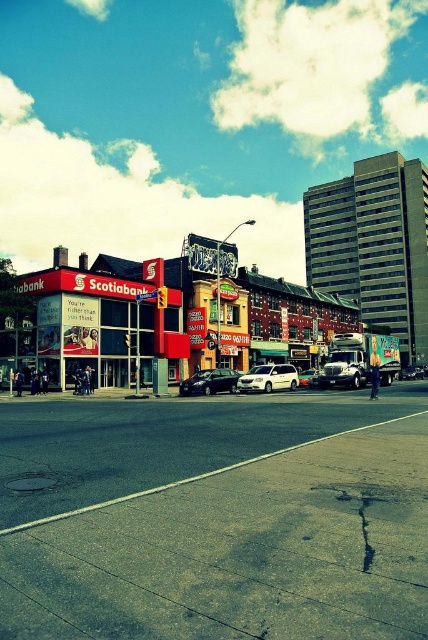
Question: Is matte red bank at center closer to the viewer compared to silver metallic sedan at center?

Choices:
 (A) no
 (B) yes

Answer: (B)

Question: Which point is farther from the camera taking this photo?

Choices:
 (A) (332, 365)
 (B) (306, 545)
 (C) (190, 378)

Answer: (A)

Question: Which point appears closest to the camera in this image?

Choices:
 (A) click(x=312, y=380)
 (B) click(x=219, y=371)
 (C) click(x=45, y=323)

Answer: (B)

Question: Does matte red bank at center appear over metallic silver truck at center?

Choices:
 (A) no
 (B) yes

Answer: (B)

Question: Among these points, which one is nearest to the camera?

Choices:
 (A) (356, 376)
 (B) (216, 374)
 (C) (309, 372)
 (D) (101, 433)

Answer: (D)

Question: Considering the relative positions of silver metallic minivan at center and metallic silver truck at center in the image provided, where is silver metallic minivan at center located with respect to metallic silver truck at center?

Choices:
 (A) above
 (B) below

Answer: (B)